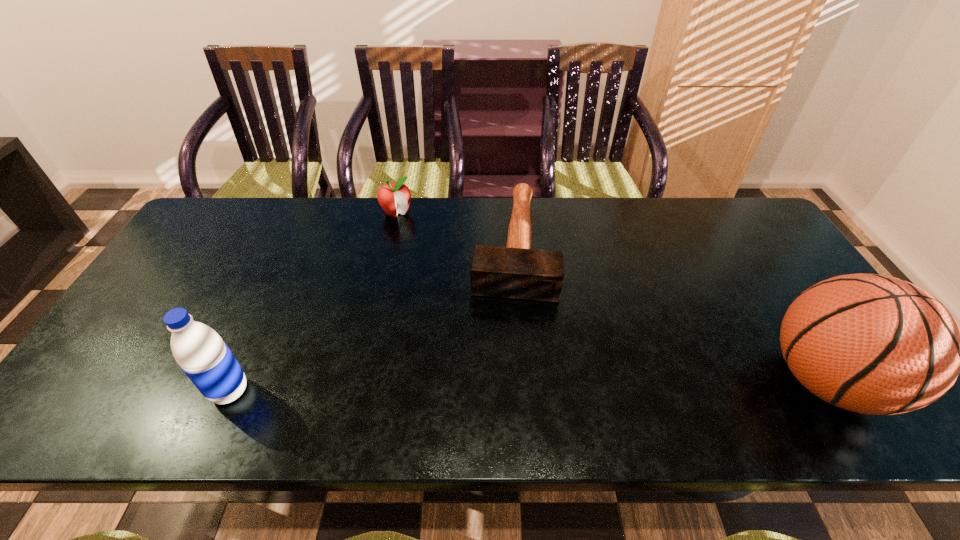
The width and height of the screenshot is (960, 540). In order to click on free location at the near edge in this screenshot , I will do `click(770, 375)`.

At what (x,y) coordinates should I click in order to perform the action: click on free region at the left edge of the desktop. Please return your answer as a coordinate pair (x, y). Looking at the image, I should click on (198, 269).

This screenshot has height=540, width=960. I want to click on free space at the far right corner of the desktop, so click(767, 240).

The height and width of the screenshot is (540, 960). I want to click on empty space between the water bottle and the third tallest object, so click(313, 302).

Find the location of a particular element. Image resolution: width=960 pixels, height=540 pixels. vacant point located between the shortest object and the leftmost object is located at coordinates (371, 318).

Image resolution: width=960 pixels, height=540 pixels. Find the location of `vacant space in between the leftmost object and the apple`. vacant space in between the leftmost object and the apple is located at coordinates (313, 302).

You are a GUI agent. You are given a task and a screenshot of the screen. Output one action in this format:
    pyautogui.click(x=<x>, y=<y>)
    Task: Click on the vacant area between the mallet and the basketball
    This screenshot has width=960, height=540.
    Given the screenshot: What is the action you would take?
    click(669, 313)

I want to click on vacant space that is in between the basketball and the second object from left to right, so click(x=612, y=296).

Identify the location of vacant region between the leftmost object and the shortest object. (371, 318).

Image resolution: width=960 pixels, height=540 pixels. Identify the location of vacant space in between the mallet and the rightmost object. (669, 313).